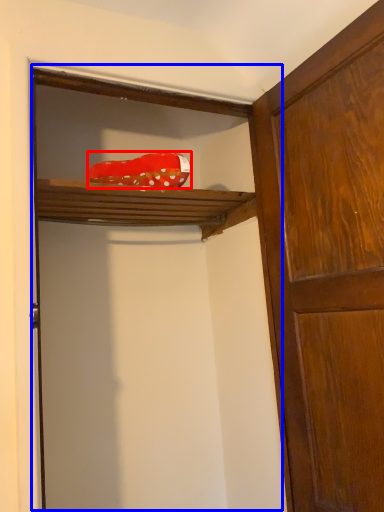
Question: Among these objects, which one is farthest to the camera, material (highlighted by a red box) or door (highlighted by a blue box)?

Choices:
 (A) material
 (B) door

Answer: (A)